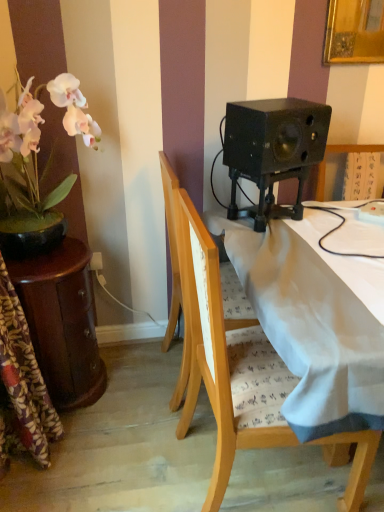
Image resolution: width=384 pixels, height=512 pixels. In order to click on vacant space in front of mahogany wooden side table at left in this screenshot , I will do `click(94, 448)`.